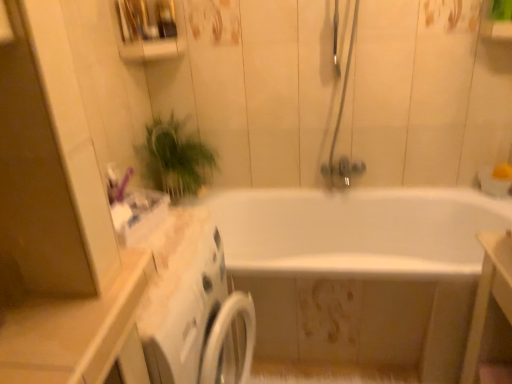
Question: From the image's perspective, is white glossy vanity at lower right under matte silver shower door at upper center?

Choices:
 (A) yes
 (B) no

Answer: (A)

Question: Does white glossy vanity at lower right have a lesser width compared to matte silver shower door at upper center?

Choices:
 (A) no
 (B) yes

Answer: (A)

Question: Is white glossy vanity at lower right at the right side of matte silver shower door at upper center?

Choices:
 (A) no
 (B) yes

Answer: (B)

Question: Is white glossy vanity at lower right positioned in front of matte silver shower door at upper center?

Choices:
 (A) yes
 (B) no

Answer: (A)

Question: Could you tell me if white glossy vanity at lower right is turned towards matte silver shower door at upper center?

Choices:
 (A) yes
 (B) no

Answer: (B)

Question: From a real-world perspective, does white glossy vanity at lower right stand above matte silver shower door at upper center?

Choices:
 (A) no
 (B) yes

Answer: (A)

Question: Can you confirm if white glossy bathtub at center is thinner than green leafy plant at upper left?

Choices:
 (A) no
 (B) yes

Answer: (A)

Question: Can you confirm if white glossy bathtub at center is positioned to the right of green leafy plant at upper left?

Choices:
 (A) no
 (B) yes

Answer: (B)

Question: Is white glossy bathtub at center smaller than green leafy plant at upper left?

Choices:
 (A) yes
 (B) no

Answer: (B)

Question: Is white glossy bathtub at center oriented towards green leafy plant at upper left?

Choices:
 (A) no
 (B) yes

Answer: (A)

Question: Can you confirm if white glossy bathtub at center is shorter than green leafy plant at upper left?

Choices:
 (A) yes
 (B) no

Answer: (B)

Question: Does white glossy bathtub at center have a greater height compared to green leafy plant at upper left?

Choices:
 (A) yes
 (B) no

Answer: (A)

Question: Considering the relative sizes of matte silver shower door at upper center and white glossy vanity at lower right in the image provided, is matte silver shower door at upper center bigger than white glossy vanity at lower right?

Choices:
 (A) no
 (B) yes

Answer: (A)